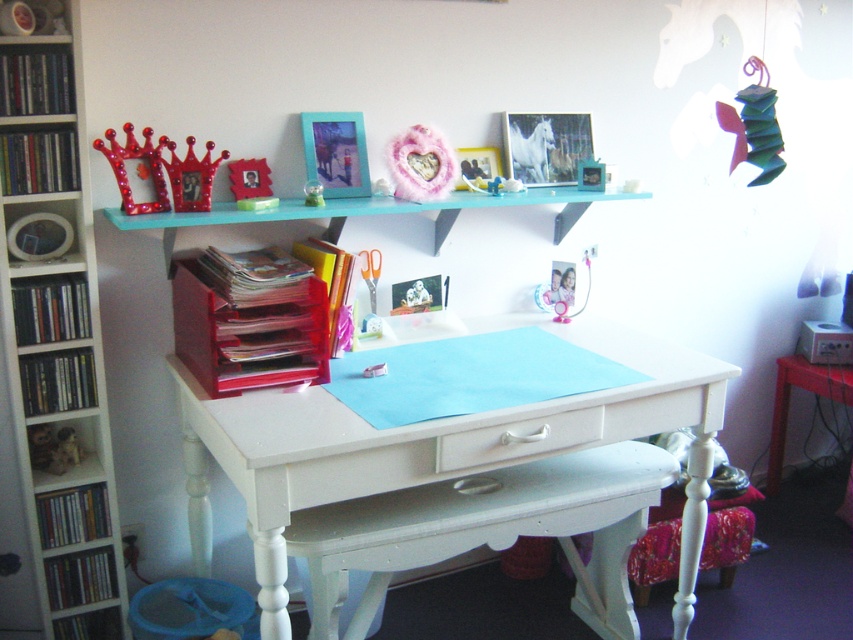
Can you confirm if white wood shelf at left is thinner than matte red crown at upper center?

Indeed, white wood shelf at left has a lesser width compared to matte red crown at upper center.

Can you confirm if white wood shelf at left is smaller than matte red crown at upper center?

Correct, white wood shelf at left occupies less space than matte red crown at upper center.

The width and height of the screenshot is (853, 640). Find the location of `white wood shelf at left`. white wood shelf at left is located at coordinates (57, 380).

Who is positioned more to the right, matte plastic shelf at left or shiny red crown at upper left?

shiny red crown at upper left

Does matte plastic shelf at left have a smaller size compared to shiny red crown at upper left?

Correct, matte plastic shelf at left occupies less space than shiny red crown at upper left.

This screenshot has height=640, width=853. In order to click on matte plastic shelf at left in this screenshot , I will do `click(50, 308)`.

Can you confirm if matte white horse at upper center is positioned to the left of wooden shelf at lower left?

In fact, matte white horse at upper center is to the right of wooden shelf at lower left.

Does matte white horse at upper center appear under wooden shelf at lower left?

Actually, matte white horse at upper center is above wooden shelf at lower left.

Find the location of a particular element. This screenshot has height=640, width=853. matte white horse at upper center is located at coordinates (544, 147).

Where is `matte white horse at upper center`? The width and height of the screenshot is (853, 640). matte white horse at upper center is located at coordinates (544, 147).